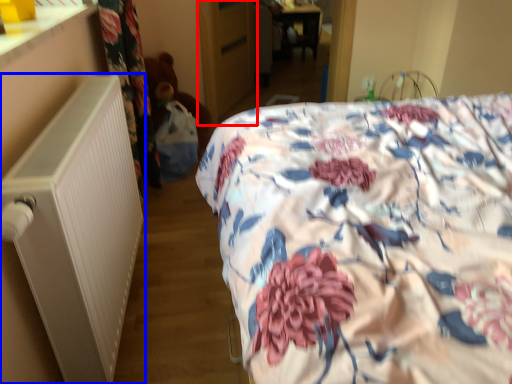
Question: Which point is closer to the camera, armoire (highlighted by a red box) or radiator (highlighted by a blue box)?

Choices:
 (A) armoire
 (B) radiator

Answer: (B)